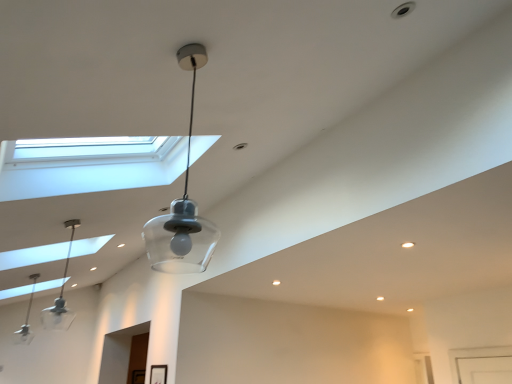
Question: Is clear glass pendant light at center, the 1th lamp viewed from the top, spatially inside clear glass pendant light at left, which ranks as the second lamp in back-to-front order, or outside of it?

Choices:
 (A) outside
 (B) inside

Answer: (A)

Question: Looking at the image, does clear glass pendant light at center, which appears as the third lamp when viewed from the left, seem bigger or smaller compared to clear glass pendant light at left, which appears as the 2th lamp when viewed from the top?

Choices:
 (A) small
 (B) big

Answer: (B)

Question: Estimate the real-world distances between objects in this image. Which object is farther from the clear glass pendant light at center, which appears as the third lamp when viewed from the left?

Choices:
 (A) clear glass pendant light at left, marked as the 3th lamp in a right-to-left arrangement
 (B) clear glass pendant light at left, which is counted as the second lamp, starting from the right

Answer: (B)

Question: Considering the real-world distances, which object is farthest from the clear glass pendant light at left, positioned as the first lamp in back-to-front order?

Choices:
 (A) clear glass pendant light at center, which is the 1th lamp in right-to-left order
 (B) clear glass pendant light at left, which appears as the 2th lamp when viewed from the top

Answer: (A)